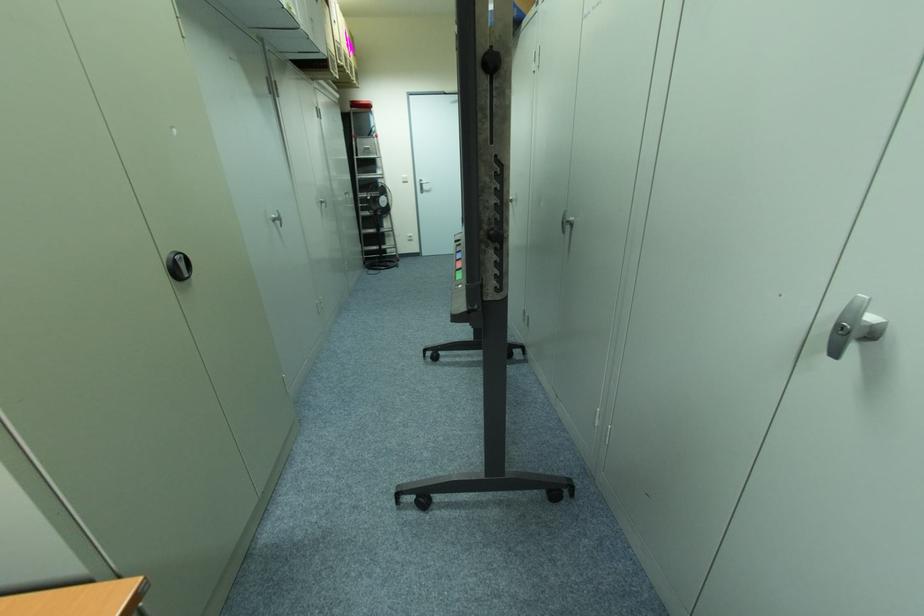
You are a GUI agent. You are given a task and a screenshot of the screen. Output one action in this format:
    pyautogui.click(x=<x>, y=<y>)
    Task: Click on the white door handle
    
    Given the screenshot: What is the action you would take?
    (x=848, y=318)